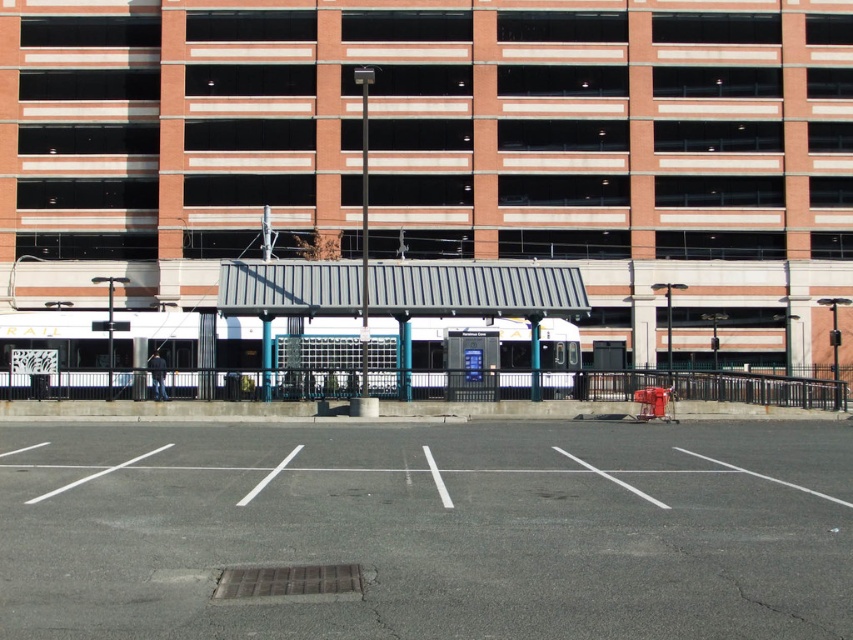
Question: Is brick parking garage at center closer to the viewer compared to gray asphalt parking lot at center?

Choices:
 (A) no
 (B) yes

Answer: (A)

Question: Can you confirm if brick parking garage at center is positioned to the left of gray asphalt parking lot at center?

Choices:
 (A) no
 (B) yes

Answer: (A)

Question: Which of the following is the farthest from the observer?

Choices:
 (A) (705, 627)
 (B) (395, 156)

Answer: (B)

Question: Does brick parking garage at center appear on the right side of gray asphalt parking lot at center?

Choices:
 (A) yes
 (B) no

Answer: (A)